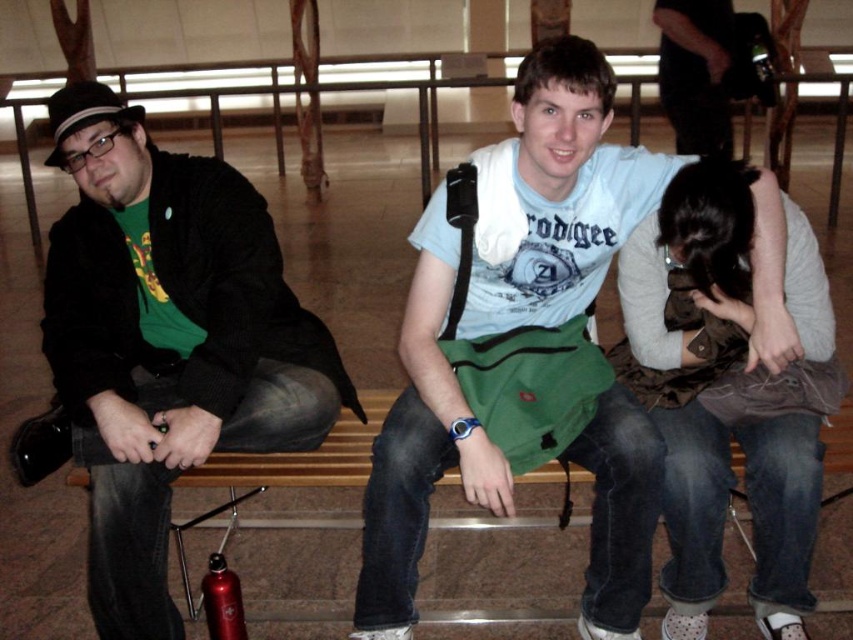
Question: Which point is farther from the camera taking this photo?

Choices:
 (A) (659, 246)
 (B) (392, 627)
 (C) (210, 588)
 (D) (161, 305)

Answer: (D)

Question: Is white cotton t-shirt at center below brown leather jacket at center?

Choices:
 (A) no
 (B) yes

Answer: (A)

Question: Which object appears farthest from the camera in this image?

Choices:
 (A) matte black jacket at left
 (B) brown leather jacket at center
 (C) metallic red water bottle at lower left

Answer: (C)

Question: Among these objects, which one is farthest from the camera?

Choices:
 (A) matte black jacket at left
 (B) white cotton t-shirt at center
 (C) brown leather jacket at center

Answer: (A)

Question: Can you confirm if matte black jacket at left is positioned above brown leather jacket at center?

Choices:
 (A) no
 (B) yes

Answer: (B)

Question: Does white cotton t-shirt at center appear over brown leather jacket at center?

Choices:
 (A) no
 (B) yes

Answer: (B)